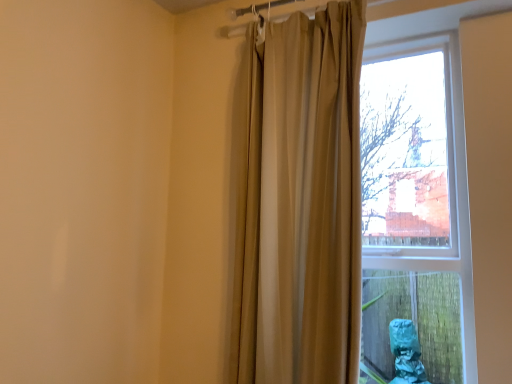
Question: Should I look upward or downward to see beige fabric curtain at center?

Choices:
 (A) down
 (B) up

Answer: (B)

Question: Can we say beige fabric curtain at center lies outside matte glass window at center?

Choices:
 (A) no
 (B) yes

Answer: (B)

Question: Is beige fabric curtain at center further to the viewer compared to matte glass window at center?

Choices:
 (A) no
 (B) yes

Answer: (B)

Question: Is beige fabric curtain at center positioned in front of matte glass window at center?

Choices:
 (A) yes
 (B) no

Answer: (B)

Question: Does beige fabric curtain at center contain matte glass window at center?

Choices:
 (A) yes
 (B) no

Answer: (B)

Question: From the image's perspective, would you say beige fabric curtain at center is positioned over matte glass window at center?

Choices:
 (A) no
 (B) yes

Answer: (B)

Question: From a real-world perspective, is beige fabric curtain at center located higher than matte glass window at center?

Choices:
 (A) yes
 (B) no

Answer: (A)

Question: From the image's perspective, is matte glass window at center under beige fabric curtain at center?

Choices:
 (A) yes
 (B) no

Answer: (A)

Question: Considering the relative positions of matte glass window at center and beige fabric curtain at center in the image provided, is matte glass window at center to the left of beige fabric curtain at center from the viewer's perspective?

Choices:
 (A) yes
 (B) no

Answer: (B)

Question: Does matte glass window at center have a larger size compared to beige fabric curtain at center?

Choices:
 (A) yes
 (B) no

Answer: (A)

Question: From the image's perspective, is matte glass window at center located above beige fabric curtain at center?

Choices:
 (A) no
 (B) yes

Answer: (A)

Question: Is beige fabric curtain at center located within matte glass window at center?

Choices:
 (A) no
 (B) yes

Answer: (A)

Question: Is matte glass window at center shorter than beige fabric curtain at center?

Choices:
 (A) no
 (B) yes

Answer: (B)

Question: In the image, is matte glass window at center on the left side or the right side of beige fabric curtain at center?

Choices:
 (A) right
 (B) left

Answer: (A)